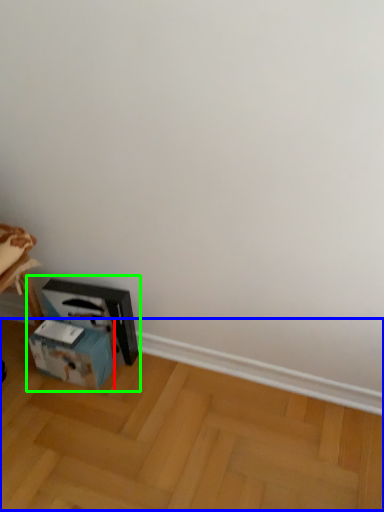
Question: Estimate the real-world distances between objects in this image. Which object is closer to box (highlighted by a red box), wood (highlighted by a blue box) or workbench (highlighted by a green box)?

Choices:
 (A) wood
 (B) workbench

Answer: (B)